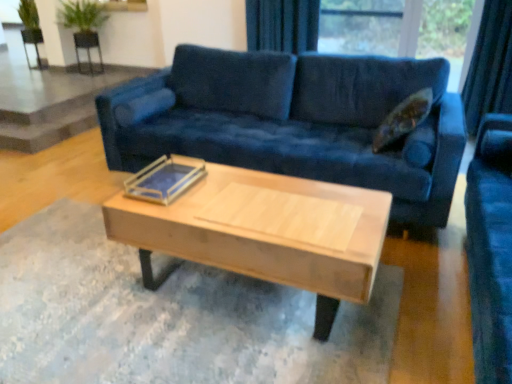
Locate an element on the screen. The height and width of the screenshot is (384, 512). vacant space underneath clear acrylic tray at center (from a real-world perspective) is located at coordinates (164, 182).